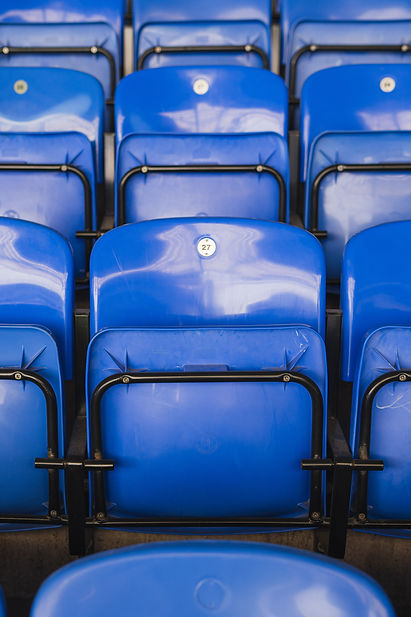
The image size is (411, 617). In order to click on underside of seat in this screenshot , I will do `click(195, 440)`, `click(25, 421)`, `click(384, 435)`, `click(377, 189)`, `click(203, 189)`, `click(54, 192)`, `click(53, 38)`, `click(184, 31)`, `click(351, 29)`.